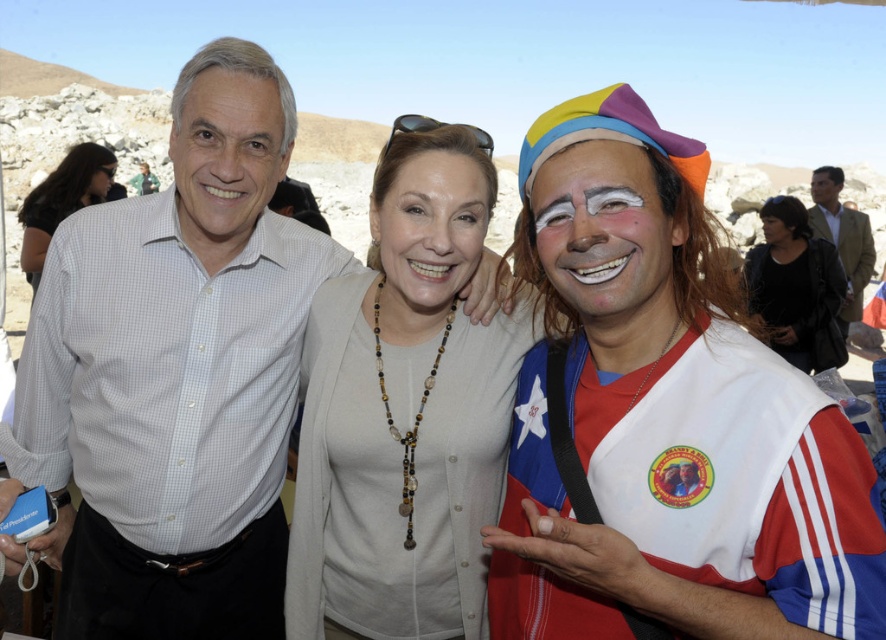
Question: Can you confirm if white jersey at center is positioned below black leather jacket at center?

Choices:
 (A) yes
 (B) no

Answer: (A)

Question: Can you confirm if brown leather jacket at right is positioned to the left of smooth skin face at upper right?

Choices:
 (A) no
 (B) yes

Answer: (B)

Question: Is white matte face paint at center to the left of matte white face at center from the viewer's perspective?

Choices:
 (A) yes
 (B) no

Answer: (B)

Question: Which of the following is the closest to the observer?

Choices:
 (A) light beige sweater at center
 (B) white matte face paint at center
 (C) white jersey at center

Answer: (C)

Question: Estimate the real-world distances between objects in this image. Which object is closer to the white checkered shirt at center?

Choices:
 (A) light beige sweater at center
 (B) smooth beige face at center

Answer: (A)

Question: Which of the following is the closest to the observer?

Choices:
 (A) black leather jacket at center
 (B) smooth beige face at center
 (C) brown leather jacket at right

Answer: (B)